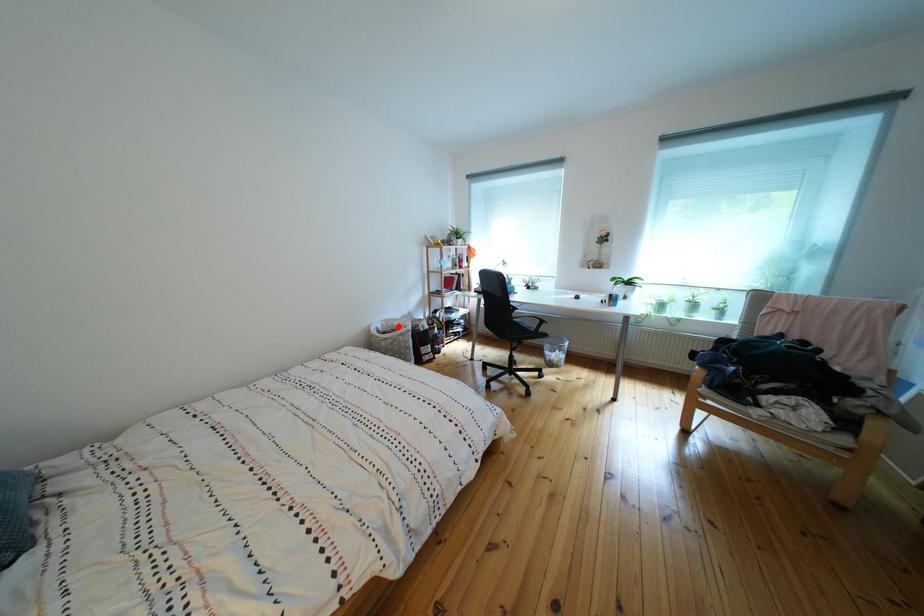
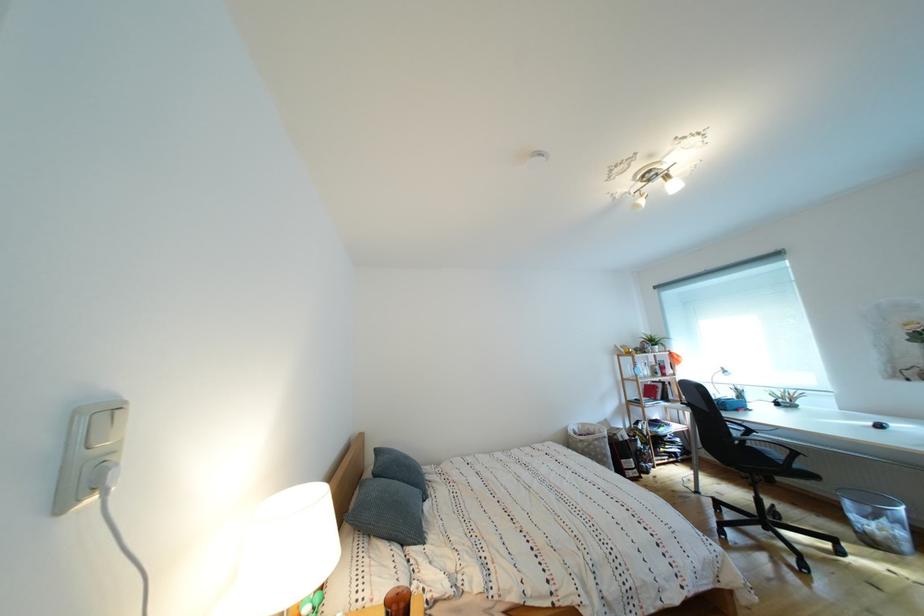
Question: I am providing you with two images of the same scene from different viewpoints. Given a red point in image1, look at the same physical point in image2. Is it:

Choices:
 (A) Closer to the viewpoint
 (B) Farther from the viewpoint

Answer: (B)